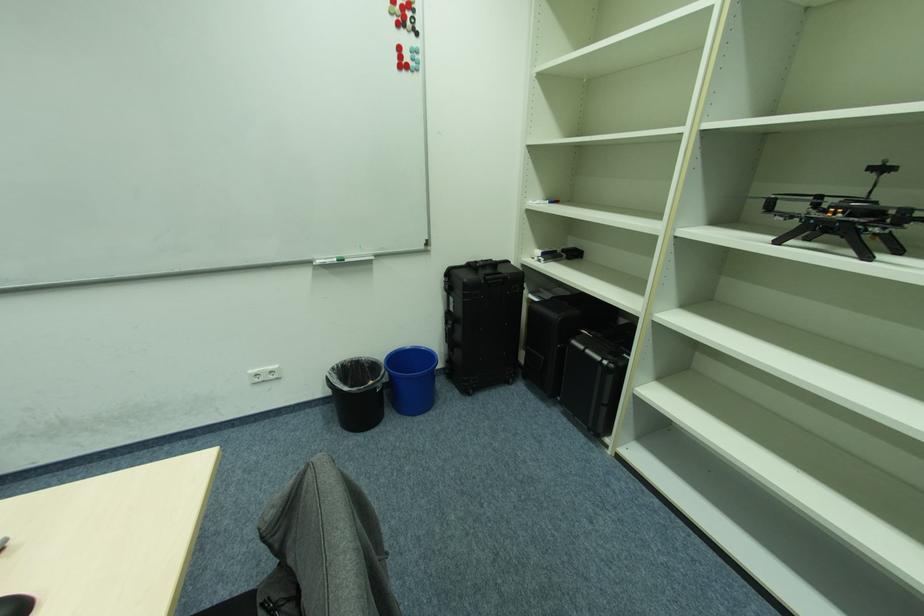
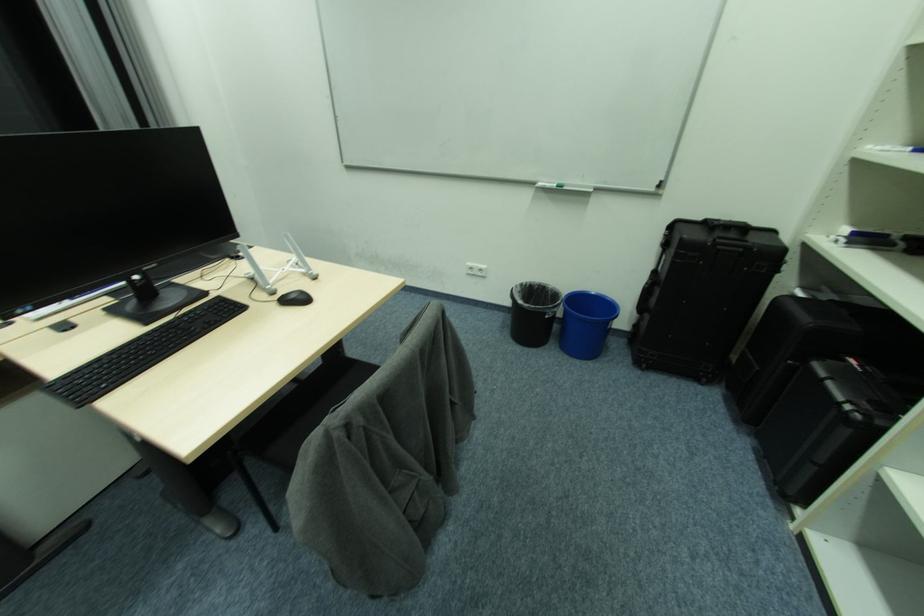
Question: The images are taken continuously from a first-person perspective. In which direction is your viewpoint rotating?

Choices:
 (A) Left
 (B) Right
 (C) Up
 (D) Down

Answer: (A)